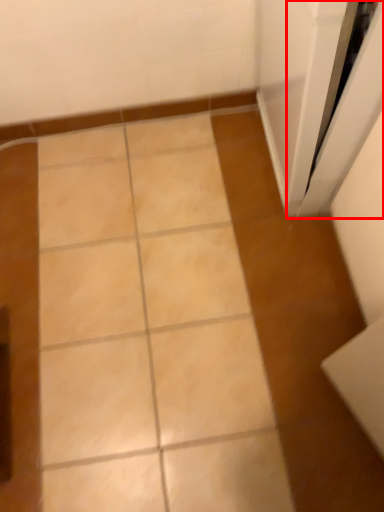
Question: From the image's perspective, where is screen door (annotated by the red box) located relative to ceramic tile?

Choices:
 (A) below
 (B) above

Answer: (B)